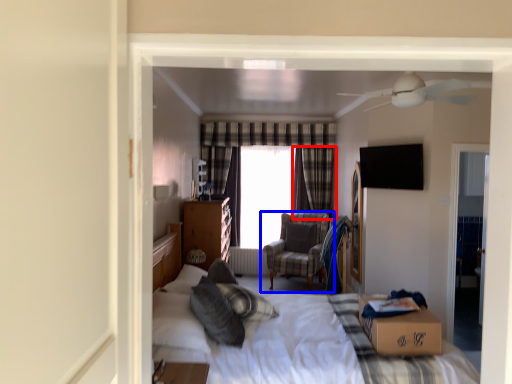
Question: Which object is closer to the camera taking this photo, curtain (highlighted by a red box) or chair (highlighted by a blue box)?

Choices:
 (A) curtain
 (B) chair

Answer: (B)